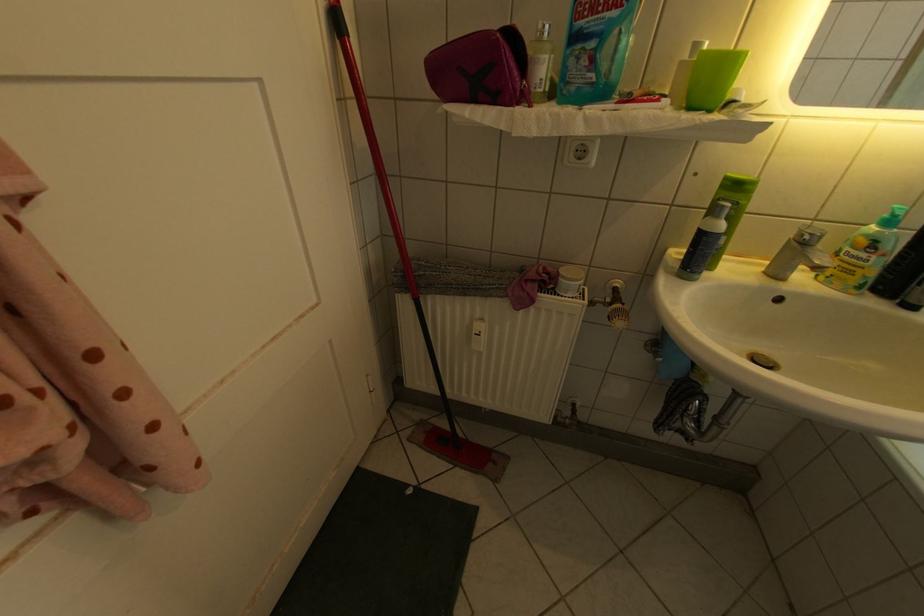
Where would you push the blue spray bottle nozzle? Please return your answer as a coordinate pair (x, y).

(864, 254)